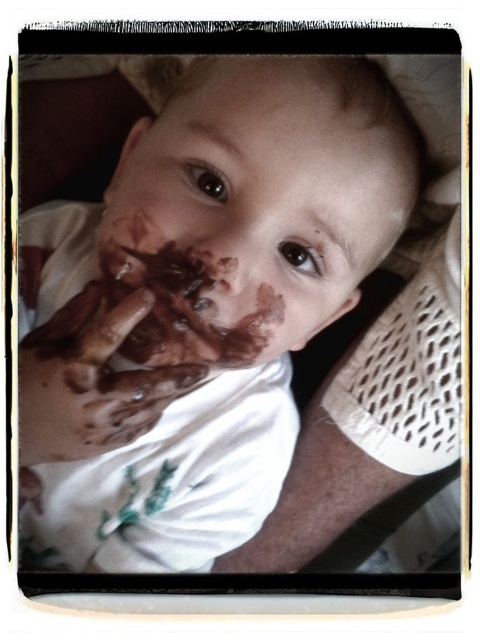
You are a photographer taking a closeup shot of a baby covered in chocolate. You notice two chocolate areas on the baby, the chocolate matte face at center and the chocolatey skin at center. Which one is located to the right side?

The chocolate matte face at center is located to the right of the chocolatey skin at center.

You are a photographer capturing a baby covered in chocolate. You notice the chocolate matte face at center and the chocolatey skin at center. Which of these two features is located on top of the other?

The chocolate matte face at center is positioned over chocolatey skin at center.

You are a photographer trying to capture the baby in the image. Where should you focus your camera to ensure the chocolate matte hands at center are in sharp focus? Please provide the coordinates in the format of a point like this example format of point format is point with coordinates like point with coordinates like point with coordinates like point with coordinates like point with coordinates like point with coordinates like point with coordinates like point with coordinates like point with coordinates.

The chocolate matte hands at center are located at point with coordinates like point with coordinates like point with coordinates like point with coordinates like point with coordinates like point with coordinates like point with coordinates like point with coordinates like point with coordinates like point with coordinates like point with coordinates like point with coordinates like point with coordinates like point with coordinates like point with coordinates like point with coordinates like point with 0.